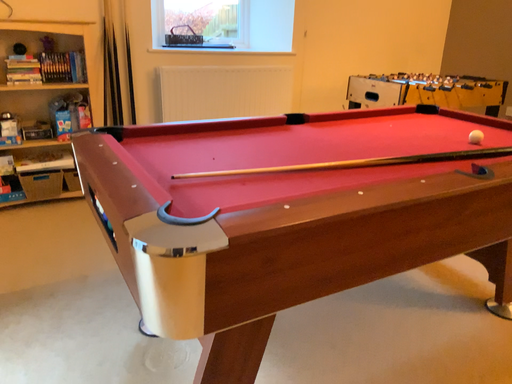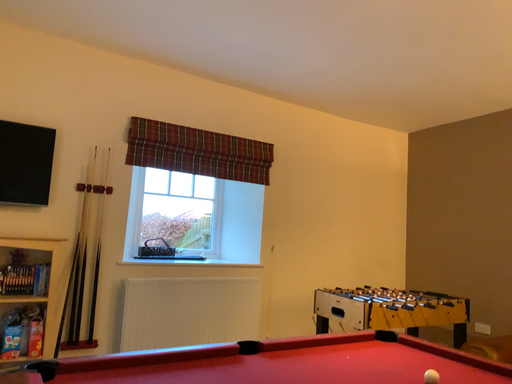
Question: How did the camera likely rotate when shooting the video?

Choices:
 (A) rotated downward
 (B) rotated upward

Answer: (B)